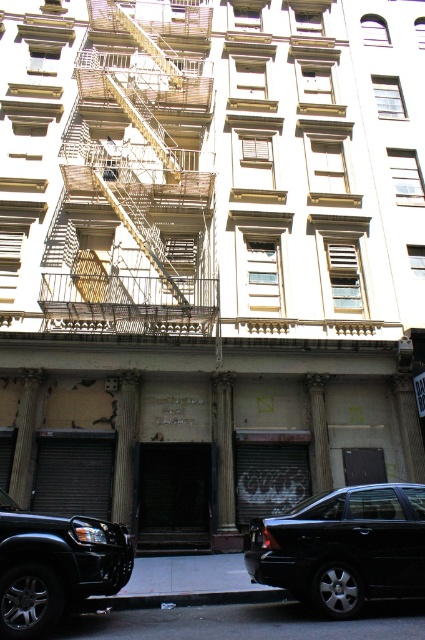
Question: Which point is farther to the camera?

Choices:
 (A) yellow metal fire escape at left
 (B) black matte suv at lower left

Answer: (A)

Question: Is shiny black sedan at center further to the viewer compared to black matte suv at lower left?

Choices:
 (A) no
 (B) yes

Answer: (B)

Question: Which object appears farthest from the camera in this image?

Choices:
 (A) black matte suv at lower left
 (B) yellow metal fire escape at left

Answer: (B)

Question: Among these points, which one is nearest to the camera?

Choices:
 (A) (59, 592)
 (B) (410, 520)
 (C) (93, 179)

Answer: (A)

Question: Considering the relative positions of yellow metal fire escape at left and black matte suv at lower left in the image provided, where is yellow metal fire escape at left located with respect to black matte suv at lower left?

Choices:
 (A) below
 (B) above

Answer: (B)

Question: Can you confirm if yellow metal fire escape at left is bigger than black matte suv at lower left?

Choices:
 (A) no
 (B) yes

Answer: (B)